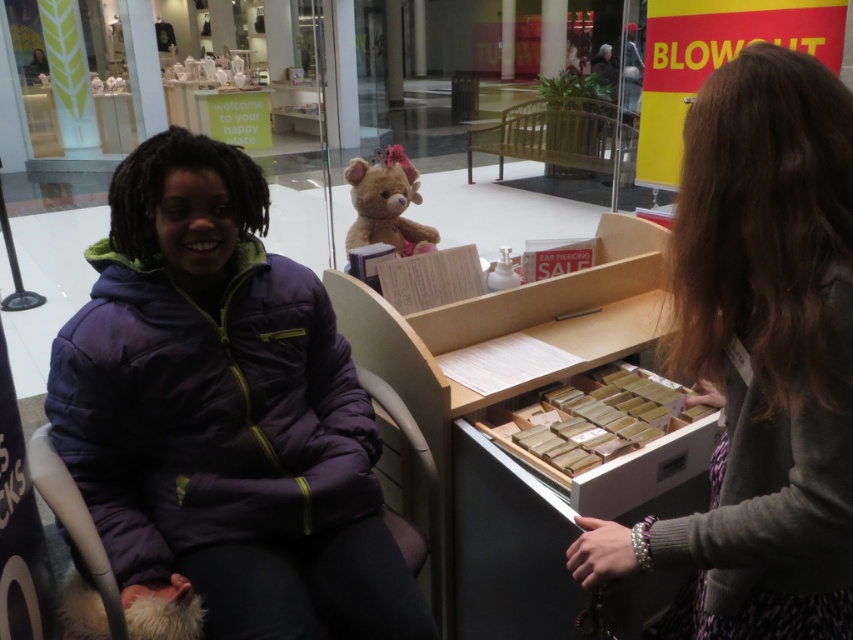
Question: Which point appears farthest from the camera in this image?

Choices:
 (A) (184, 152)
 (B) (730, 449)

Answer: (A)

Question: Among these points, which one is farthest from the camera?

Choices:
 (A) (677, 250)
 (B) (218, 496)

Answer: (B)

Question: Does gray knit sweater at center appear on the left side of fluffy brown bear at upper center?

Choices:
 (A) no
 (B) yes

Answer: (A)

Question: Which of the following is the closest to the observer?

Choices:
 (A) purple puffy jacket at center
 (B) gray knit sweater at center

Answer: (B)

Question: Does purple puffy jacket at center have a greater width compared to gray knit sweater at center?

Choices:
 (A) yes
 (B) no

Answer: (A)

Question: Can you confirm if purple puffy jacket at center is bigger than fluffy brown bear at upper center?

Choices:
 (A) yes
 (B) no

Answer: (A)